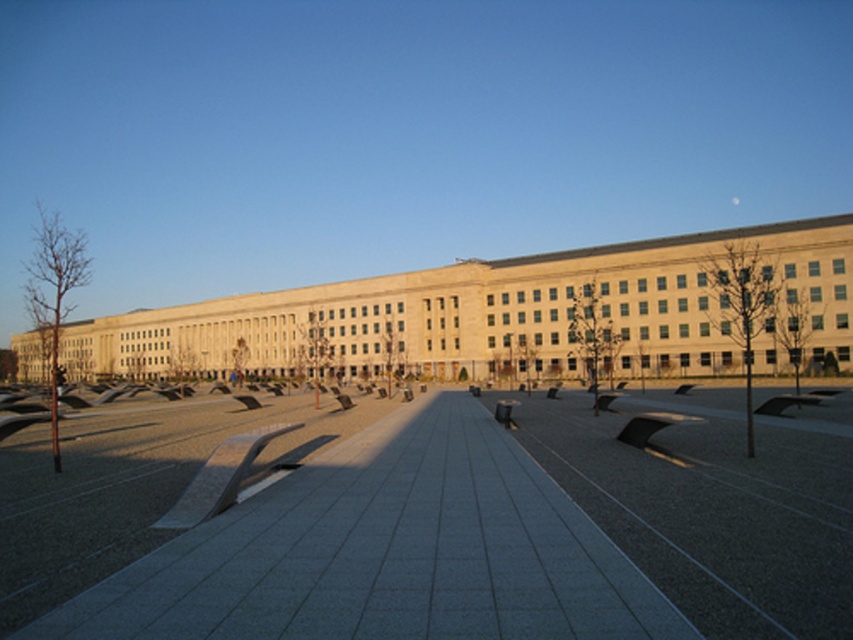
Does smooth concrete skate park at center appear on the right side of beige stone plaza at center?

Yes, smooth concrete skate park at center is to the right of beige stone plaza at center.

The image size is (853, 640). What do you see at coordinates (515, 532) in the screenshot? I see `smooth concrete skate park at center` at bounding box center [515, 532].

Find the location of a particular element. The width and height of the screenshot is (853, 640). smooth concrete skate park at center is located at coordinates (515, 532).